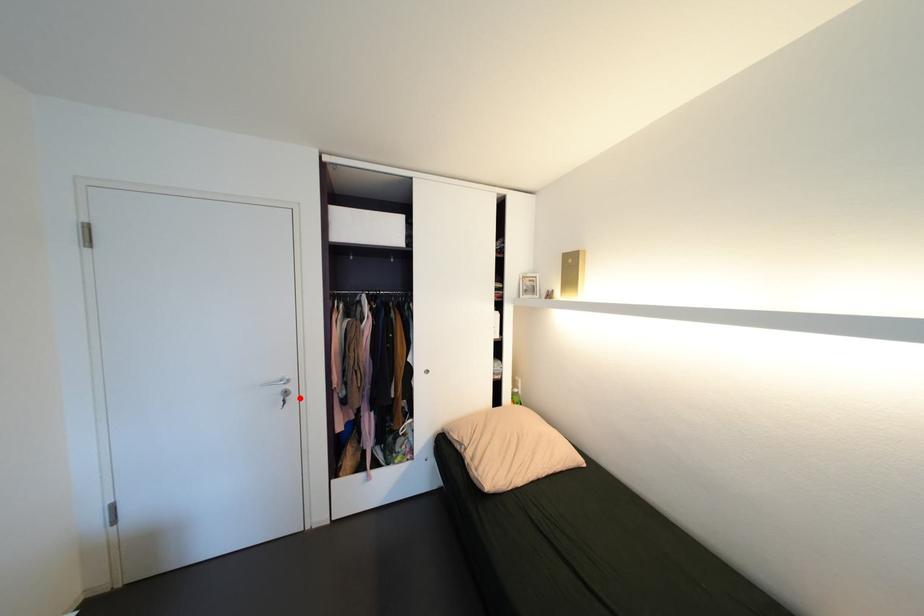
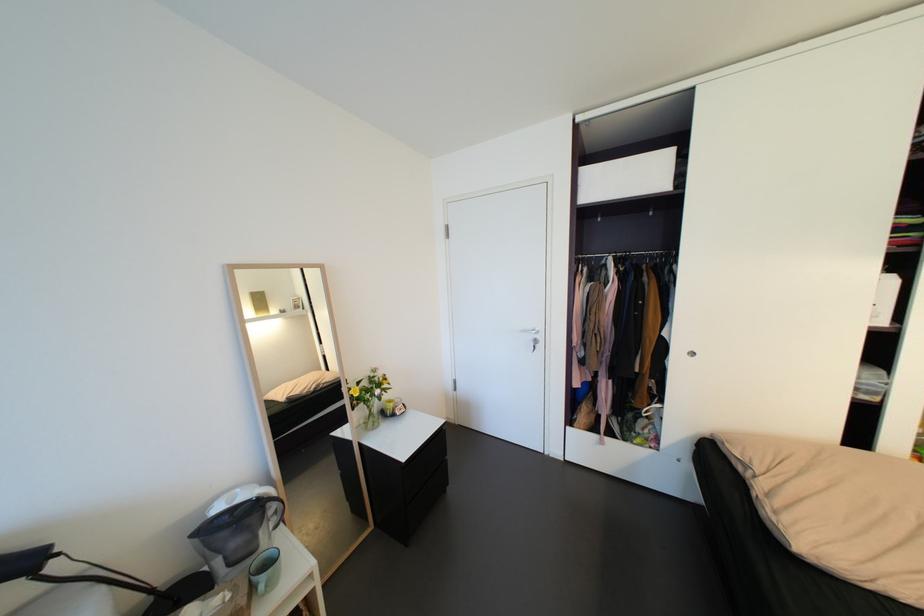
The point at the highlighted location is marked in the first image. Where is the corresponding point in the second image?

(548, 346)